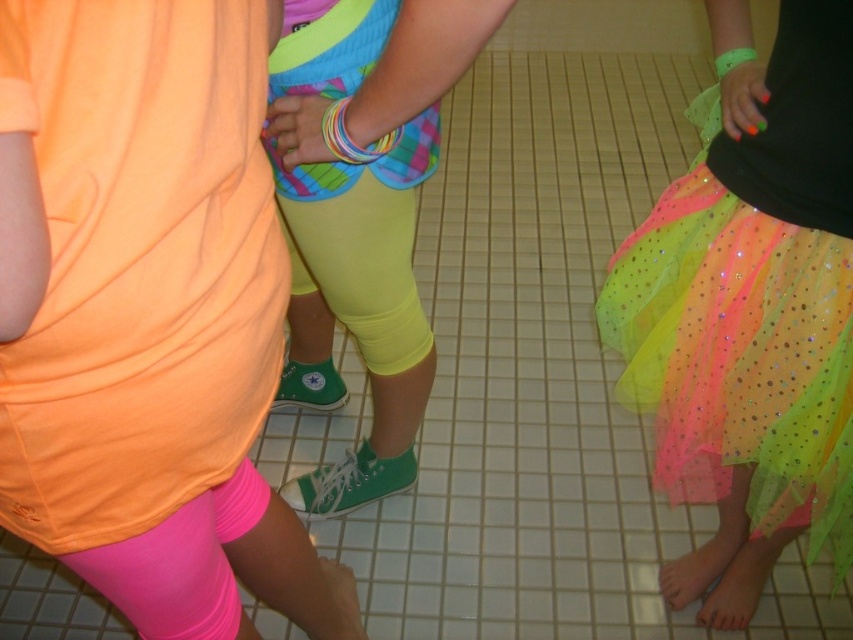
Is the position of neon sequined tutu at center more distant than that of neon yellow spandex at center?

Yes.

What are the coordinates of `neon sequined tutu at center` in the screenshot? It's located at (750, 308).

Which is in front, point (68, 234) or point (351, 506)?

Point (68, 234) is in front.

Can you confirm if neon tulle skirt at lower right is wider than neon yellow spandex at center?

No, neon tulle skirt at lower right is not wider than neon yellow spandex at center.

Identify the location of neon tulle skirt at lower right. (131, 262).

The height and width of the screenshot is (640, 853). What are the coordinates of `neon tulle skirt at lower right` in the screenshot? It's located at (131, 262).

Which is more to the left, neon tulle skirt at lower right or neon sequined tutu at center?

neon tulle skirt at lower right

Describe the element at coordinates (131, 262) in the screenshot. I see `neon tulle skirt at lower right` at that location.

Locate an element on the screen. This screenshot has height=640, width=853. neon tulle skirt at lower right is located at coordinates (131, 262).